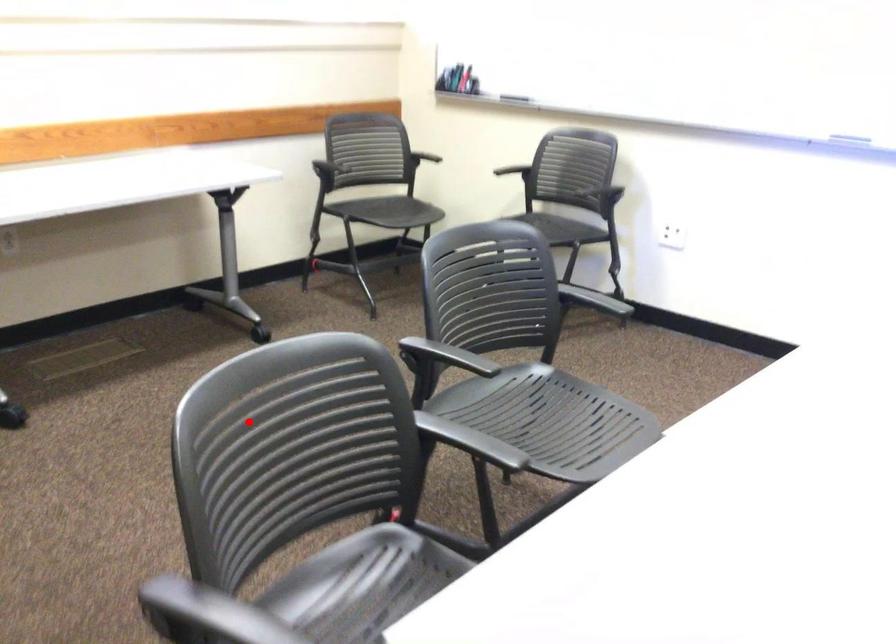
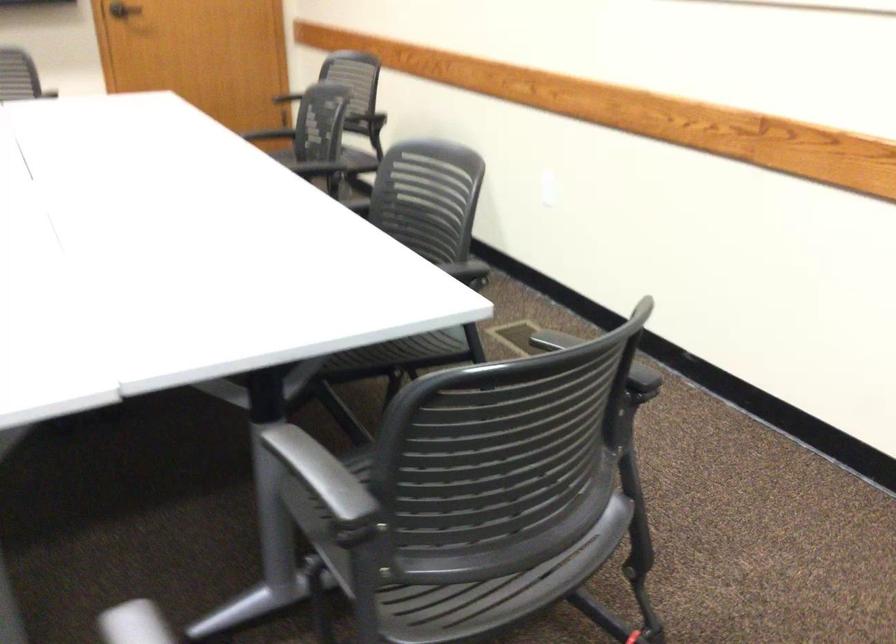
Find the pixel in the second image that matches the highlighted location in the first image.

(598, 359)